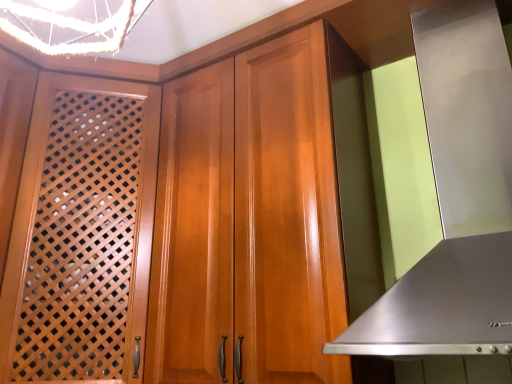
Question: Can you confirm if stainless steel exhaust hood at right is bigger than wooden lattice screen door at left?

Choices:
 (A) yes
 (B) no

Answer: (B)

Question: Is stainless steel exhaust hood at right thinner than wooden lattice screen door at left?

Choices:
 (A) yes
 (B) no

Answer: (A)

Question: Is stainless steel exhaust hood at right positioned with its back to wooden lattice screen door at left?

Choices:
 (A) no
 (B) yes

Answer: (A)

Question: Is stainless steel exhaust hood at right positioned far away from wooden lattice screen door at left?

Choices:
 (A) yes
 (B) no

Answer: (B)

Question: Is stainless steel exhaust hood at right next to wooden lattice screen door at left and touching it?

Choices:
 (A) yes
 (B) no

Answer: (B)

Question: Considering the relative sizes of stainless steel exhaust hood at right and wooden lattice screen door at left in the image provided, is stainless steel exhaust hood at right taller than wooden lattice screen door at left?

Choices:
 (A) yes
 (B) no

Answer: (B)

Question: Can you confirm if wooden lattice screen door at left is thinner than stainless steel exhaust hood at right?

Choices:
 (A) no
 (B) yes

Answer: (A)

Question: Is stainless steel exhaust hood at right located within wooden lattice screen door at left?

Choices:
 (A) yes
 (B) no

Answer: (B)

Question: From the image's perspective, does wooden lattice screen door at left appear higher than stainless steel exhaust hood at right?

Choices:
 (A) no
 (B) yes

Answer: (A)

Question: Can you confirm if wooden lattice screen door at left is smaller than stainless steel exhaust hood at right?

Choices:
 (A) no
 (B) yes

Answer: (A)

Question: Does wooden lattice screen door at left have a larger size compared to stainless steel exhaust hood at right?

Choices:
 (A) yes
 (B) no

Answer: (A)

Question: Is wooden lattice screen door at left not inside stainless steel exhaust hood at right?

Choices:
 (A) yes
 (B) no

Answer: (A)

Question: Is point (154, 163) positioned closer to the camera than point (474, 205)?

Choices:
 (A) farther
 (B) closer

Answer: (A)